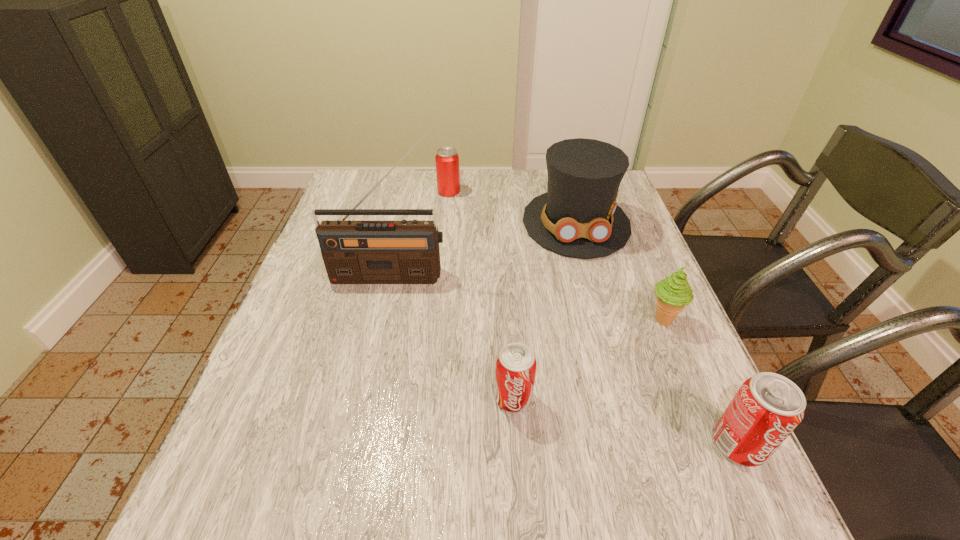
Identify the location of vacant position in the image that satisfies the following two spatial constraints: 1. on the front side of the fifth farthest object; 2. on the right side of the can. (428, 398).

Where is `blank space that satisfies the following two spatial constraints: 1. with goggles on the front of the right soda can; 2. on the right side of the dress hat`? blank space that satisfies the following two spatial constraints: 1. with goggles on the front of the right soda can; 2. on the right side of the dress hat is located at coordinates (637, 444).

Find the location of a particular element. The image size is (960, 540). vacant area in the image that satisfies the following two spatial constraints: 1. with goggles on the front of the taller soda can; 2. on the left side of the dress hat is located at coordinates (637, 444).

At what (x,y) coordinates should I click in order to perform the action: click on blank area in the image that satisfies the following two spatial constraints: 1. on the front-facing side of the farther soda can; 2. on the right side of the tallest object. Please return your answer as a coordinate pair (x, y). Looking at the image, I should click on (364, 398).